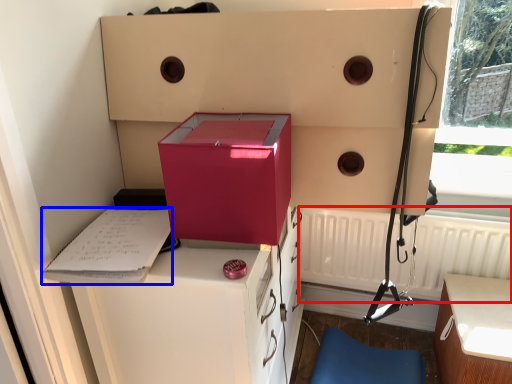
Question: Which of the following is the farthest to the observer, radiator (highlighted by a red box) or clipboard (highlighted by a blue box)?

Choices:
 (A) radiator
 (B) clipboard

Answer: (A)